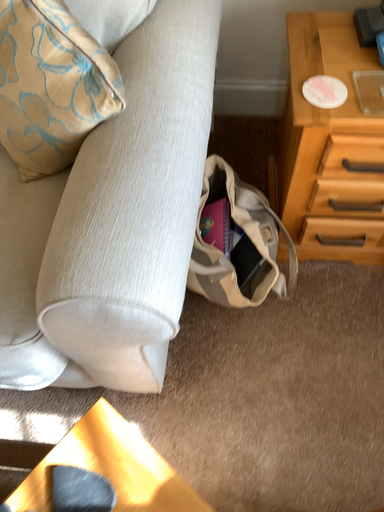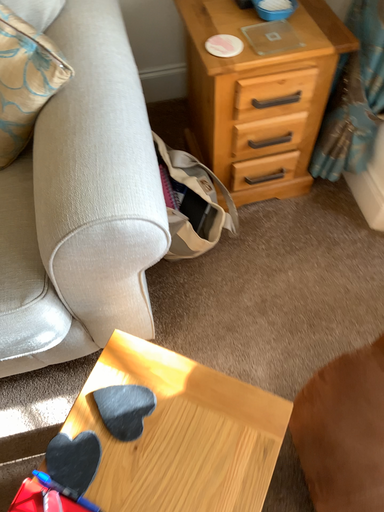
Question: How did the camera likely rotate when shooting the video?

Choices:
 (A) rotated right
 (B) rotated left

Answer: (A)